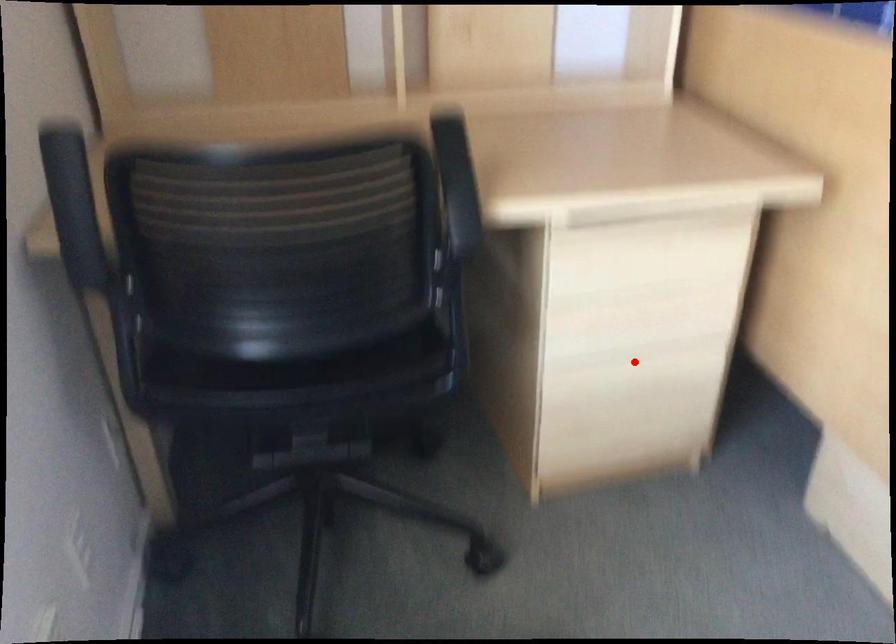
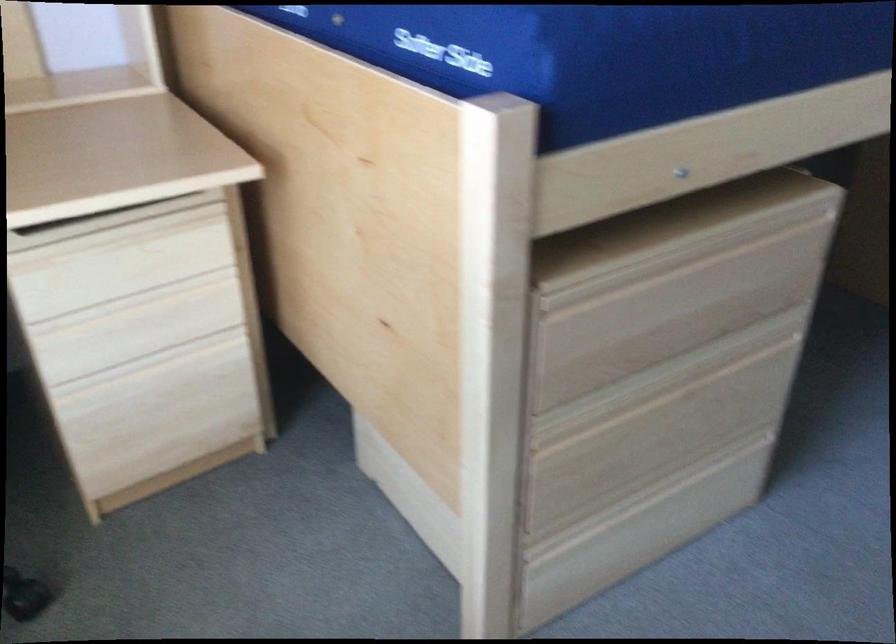
Locate, in the second image, the point that corresponds to the highlighted location in the first image.

(152, 361)